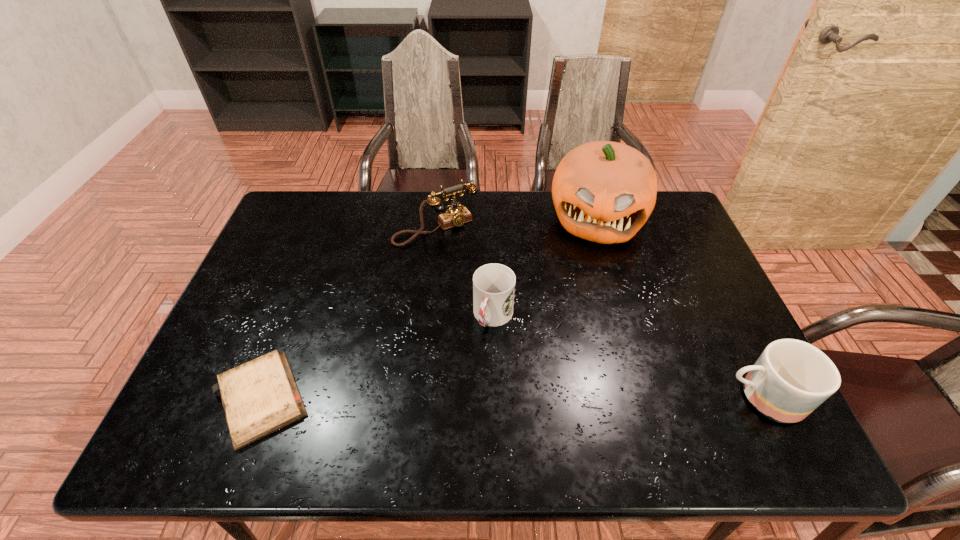
Identify the location of telephone at the far edge. The width and height of the screenshot is (960, 540). (456, 216).

At what (x,y) coordinates should I click in order to perform the action: click on pumpkin that is positioned at the far edge. Please return your answer as a coordinate pair (x, y). The image size is (960, 540). Looking at the image, I should click on (603, 191).

Locate an element on the screen. diary that is at the near edge is located at coordinates (259, 397).

This screenshot has height=540, width=960. What are the coordinates of `mug located in the near edge section of the desktop` in the screenshot? It's located at (791, 378).

Where is `object present at the left edge`? object present at the left edge is located at coordinates (259, 397).

Locate an element on the screen. The image size is (960, 540). mug situated at the right edge is located at coordinates (791, 378).

Locate an element on the screen. This screenshot has height=540, width=960. pumpkin that is at the right edge is located at coordinates (603, 191).

What are the coordinates of `object that is at the near left corner` in the screenshot? It's located at (259, 397).

Find the location of a particular element. This screenshot has width=960, height=540. object situated at the far right corner is located at coordinates (603, 191).

The height and width of the screenshot is (540, 960). In order to click on object that is positioned at the near right corner in this screenshot , I will do `click(791, 378)`.